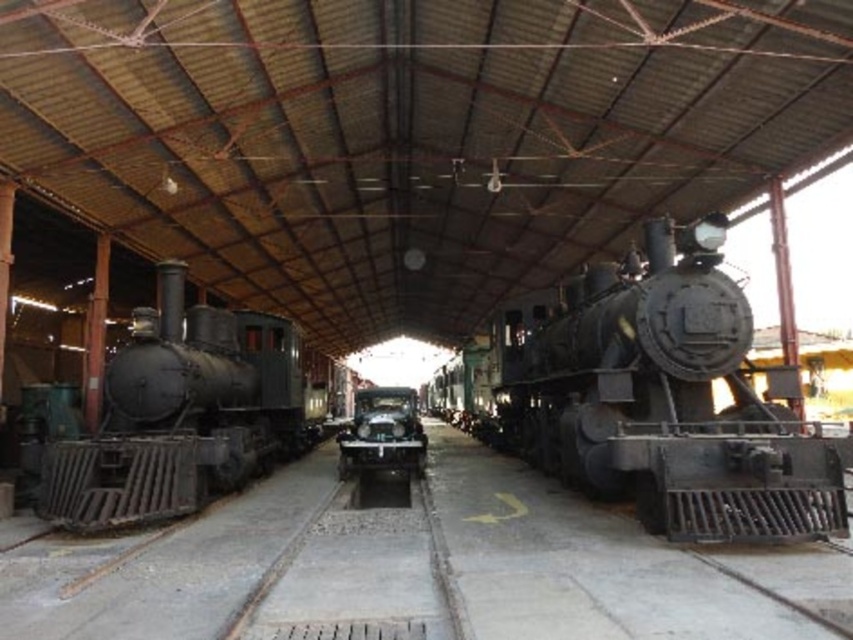
You are a visitor standing at the entrance of the railway shed. You see the matte black locomotive at left and the shiny silver car at center. Which object is closer to you?

The matte black locomotive at left is closer to you since it is in front of the shiny silver car at center.

You are a visitor standing in the middle of the railway shed. You want to take a photo of the shiny silver car at center without the matte black locomotive at left blocking the view. Which direction should you move to ensure the car is visible and the locomotive is out of frame?

Move to the right side of the shed. Since the matte black locomotive at left is to the left of the shiny silver car at center, moving right will position you away from the locomotive, allowing the car to be visible without obstruction.